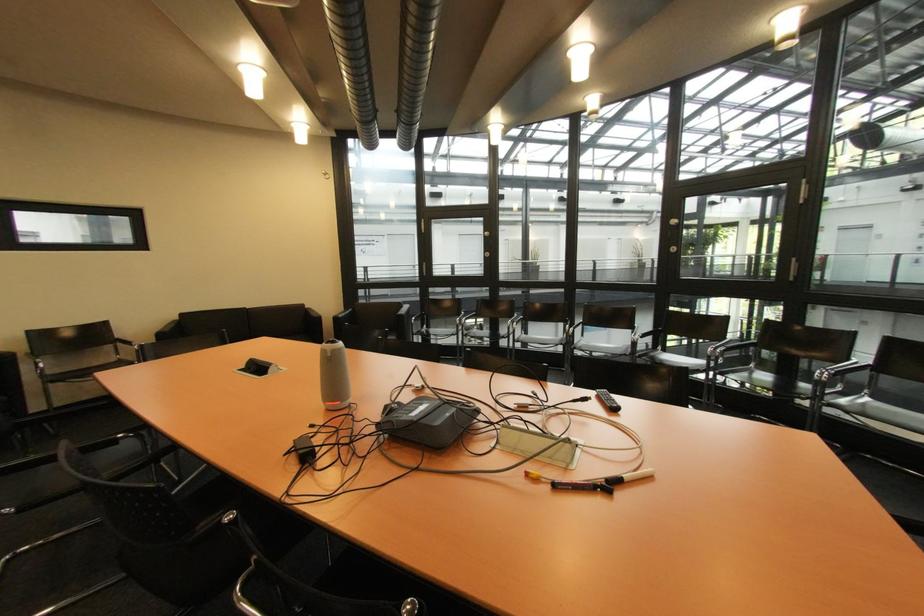
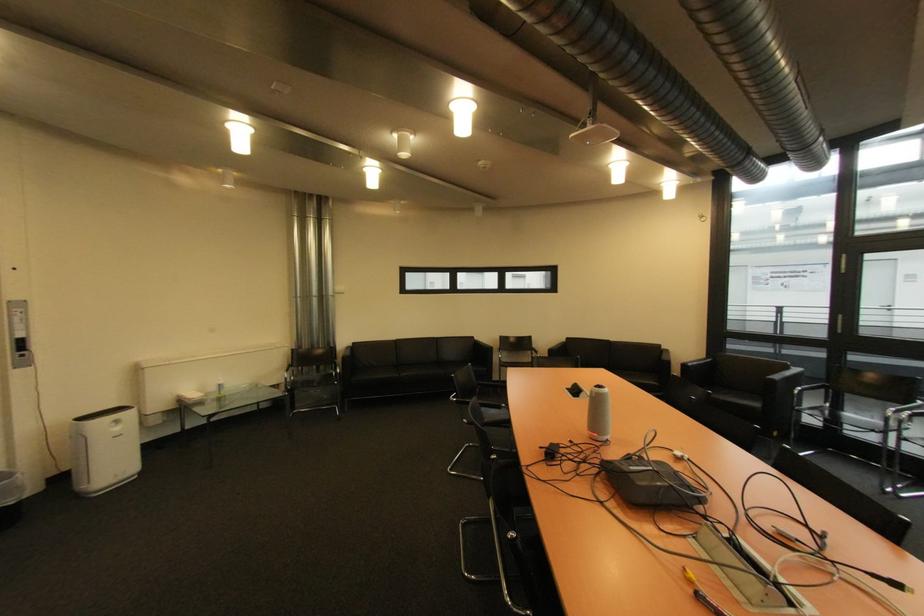
Find the pixel in the second image that matches pixel 251 368 in the first image.

(578, 389)